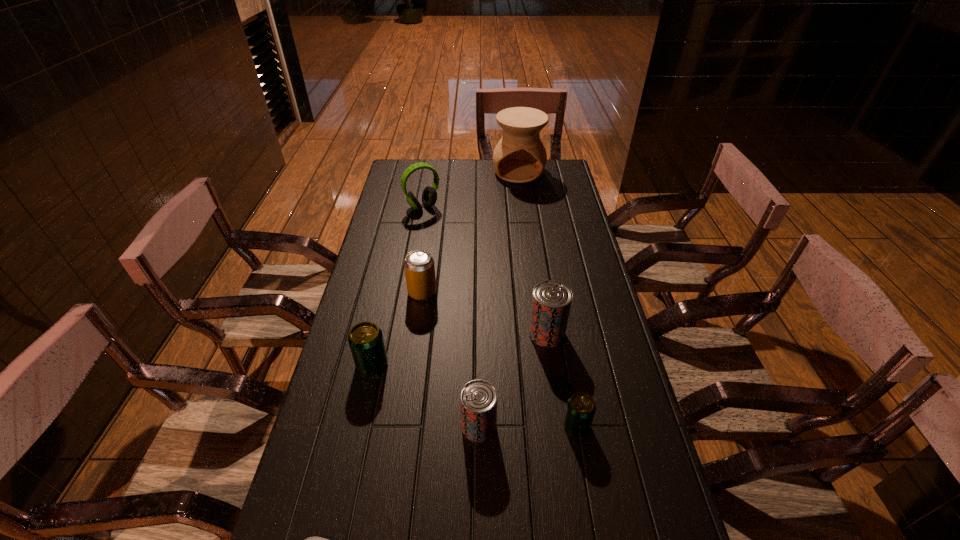
Identify the location of free space between the third beer can from right to left and the second farthest object. (451, 316).

At what (x,y) coordinates should I click in order to perform the action: click on unoccupied position between the green headset and the fifth farthest object. Please return your answer as a coordinate pair (x, y). Looking at the image, I should click on (397, 286).

Find the location of a particular element. vacant region between the pop (soda) and the farther green beer can is located at coordinates [x=397, y=328].

You are a GUI agent. You are given a task and a screenshot of the screen. Output one action in this format:
    pyautogui.click(x=<x>, y=<y>)
    Task: Click on the object identified as the sixth closest to the pop (soda)
    Image resolution: width=960 pixels, height=540 pixels.
    Given the screenshot: What is the action you would take?
    pyautogui.click(x=519, y=157)

At what (x,y) coordinates should I click in order to perform the action: click on the third closest object to the third farthest object. Please return your answer as a coordinate pair (x, y). Looking at the image, I should click on (478, 399).

Find the location of a particular element. The image size is (960, 540). beer can that is the closest to the pottery is located at coordinates pyautogui.click(x=551, y=302).

Identify which beer can is the nearest to the leftmost beer can. Please provide its 2D coordinates. Your answer should be formatted as a tuple, i.e. [(x, y)], where the tuple contains the x and y coordinates of a point satisfying the conditions above.

[(478, 399)]

Point out which red beer can is positioned as the second nearest to the sixth nearest object. Please provide its 2D coordinates. Your answer should be formatted as a tuple, i.e. [(x, y)], where the tuple contains the x and y coordinates of a point satisfying the conditions above.

[(478, 399)]

Locate an element on the screen. vacant space that satisfies the following two spatial constraints: 1. on the front side of the fourth object from right to left; 2. on the left side of the leftmost beer can is located at coordinates (358, 426).

At what (x,y) coordinates should I click in order to perform the action: click on free point that satisfies the following two spatial constraints: 1. on the back side of the bigger red beer can; 2. on the right side of the smaller red beer can. Please return your answer as a coordinate pair (x, y). Looking at the image, I should click on click(479, 334).